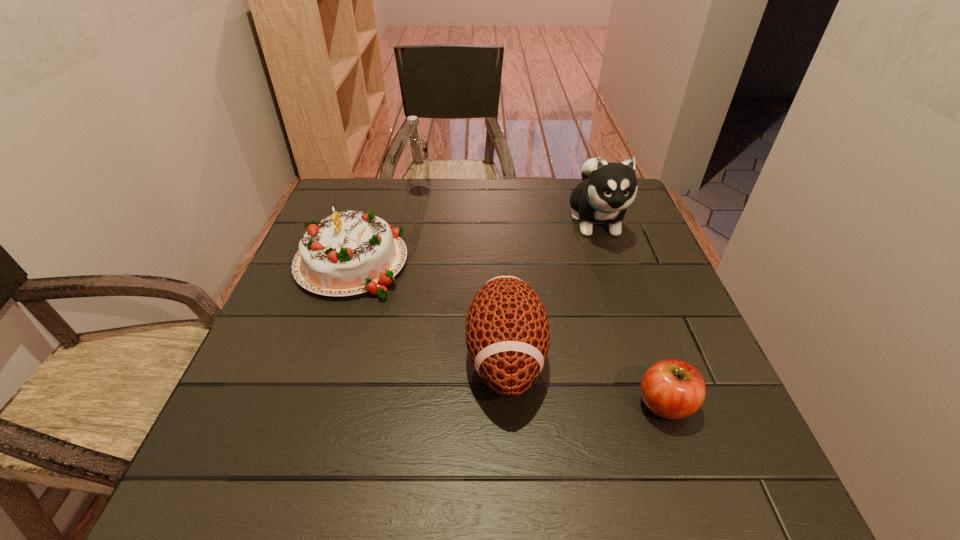
Locate an element on the screen. The image size is (960, 540). vacant area at the far left corner is located at coordinates (351, 181).

The width and height of the screenshot is (960, 540). In the image, there is a desktop. Find the location of `free space at the near left corner`. free space at the near left corner is located at coordinates (301, 457).

In the image, there is a desktop. At what (x,y) coordinates should I click in order to perform the action: click on free space at the far right corner. Please return your answer as a coordinate pair (x, y). Looking at the image, I should click on [x=575, y=187].

Identify the location of vacant space that is in between the football and the puppy. (551, 288).

Find the location of a particular element. This screenshot has height=540, width=960. free area in between the third object from left to right and the shortest object is located at coordinates (x=586, y=380).

In order to click on free space between the cake and the third object from right to left in this screenshot , I will do `click(428, 309)`.

The width and height of the screenshot is (960, 540). What are the coordinates of `vacant space in between the shortest object and the puppy` in the screenshot? It's located at (631, 312).

Where is `free area in between the puppy and the vodka`? The width and height of the screenshot is (960, 540). free area in between the puppy and the vodka is located at coordinates (508, 206).

The image size is (960, 540). Identify the location of empty space between the apple and the vodka. coord(542,297).

The image size is (960, 540). What are the coordinates of `free space between the apple and the puppy` in the screenshot? It's located at (x=631, y=312).